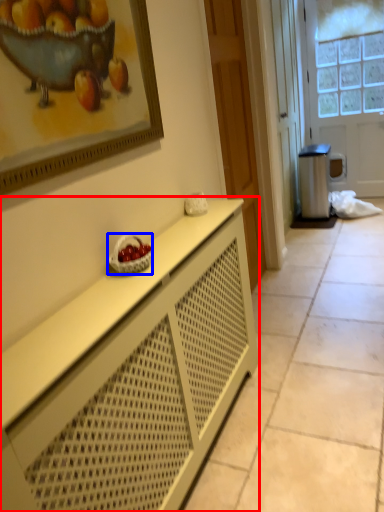
Question: Which object appears farthest to the camera in this image, cabinetry (highlighted by a red box) or fruit dish (highlighted by a blue box)?

Choices:
 (A) cabinetry
 (B) fruit dish

Answer: (B)